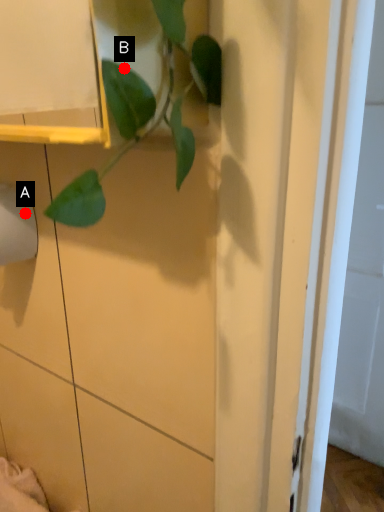
Question: Two points are circled on the image, labeled by A and B beside each circle. Among these points, which one is nearest to the camera?

Choices:
 (A) A is closer
 (B) B is closer

Answer: (B)